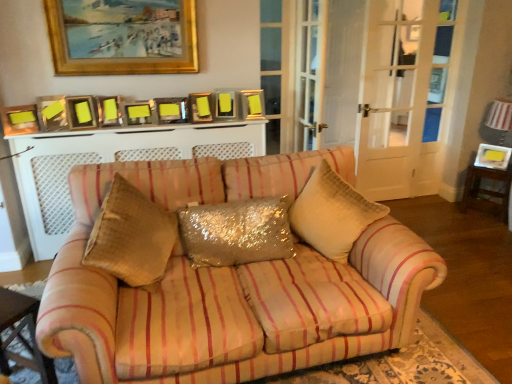
The image size is (512, 384). In order to click on free spot to the left of wooden table at right, which appears as the first table when viewed from the top in this screenshot , I will do `click(442, 212)`.